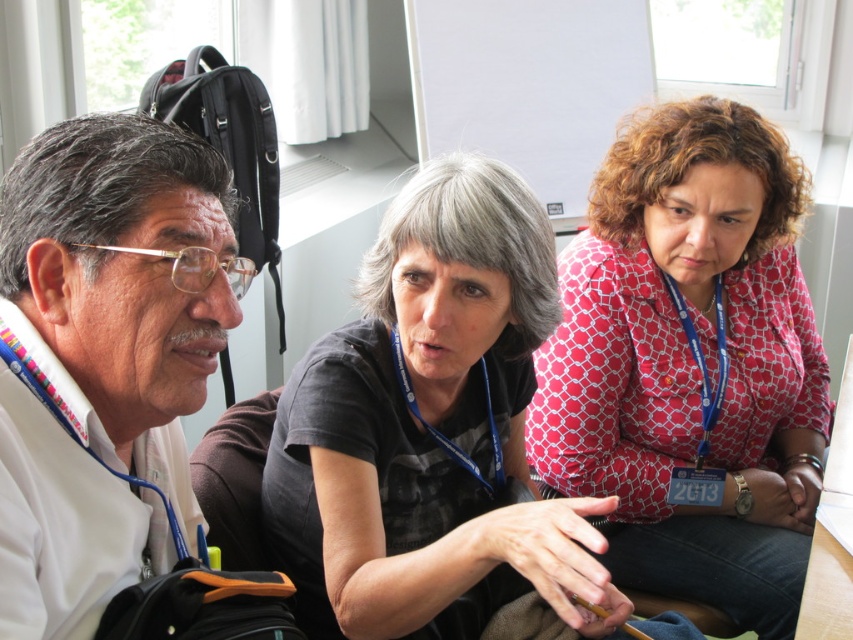
Is black matte shirt at center smaller than white matte shirt at left?

No.

Between black matte shirt at center and white matte shirt at left, which one has more height?

With more height is black matte shirt at center.

I want to click on black matte shirt at center, so click(431, 428).

Which is more to the right, red dotted blouse at center or white matte shirt at left?

Positioned to the right is red dotted blouse at center.

Between red dotted blouse at center and white matte shirt at left, which one has more height?

red dotted blouse at center is taller.

Does point (654, 145) lie in front of point (54, 378)?

No, (654, 145) is behind (54, 378).

Identify the location of red dotted blouse at center. (689, 362).

Does red dotted blouse at center appear on the left side of black matte shirt at center?

Incorrect, red dotted blouse at center is not on the left side of black matte shirt at center.

Between red dotted blouse at center and black matte shirt at center, which one has less height?

black matte shirt at center is shorter.

Which is behind, point (596, 177) or point (349, 372)?

Point (596, 177)

The image size is (853, 640). I want to click on red dotted blouse at center, so click(x=689, y=362).